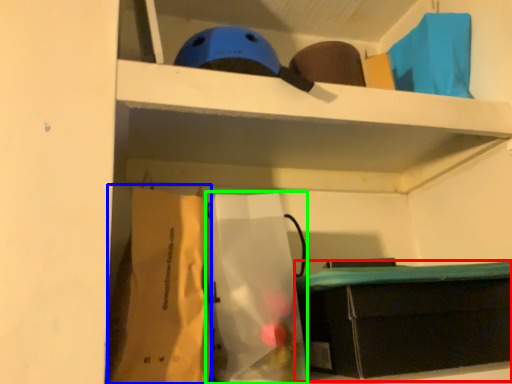
Question: Which object is the farthest from furniture (highlighted by a red box)? Choose among these: paper bag (highlighted by a blue box) or paper bag (highlighted by a green box).

Choices:
 (A) paper bag
 (B) paper bag

Answer: (A)